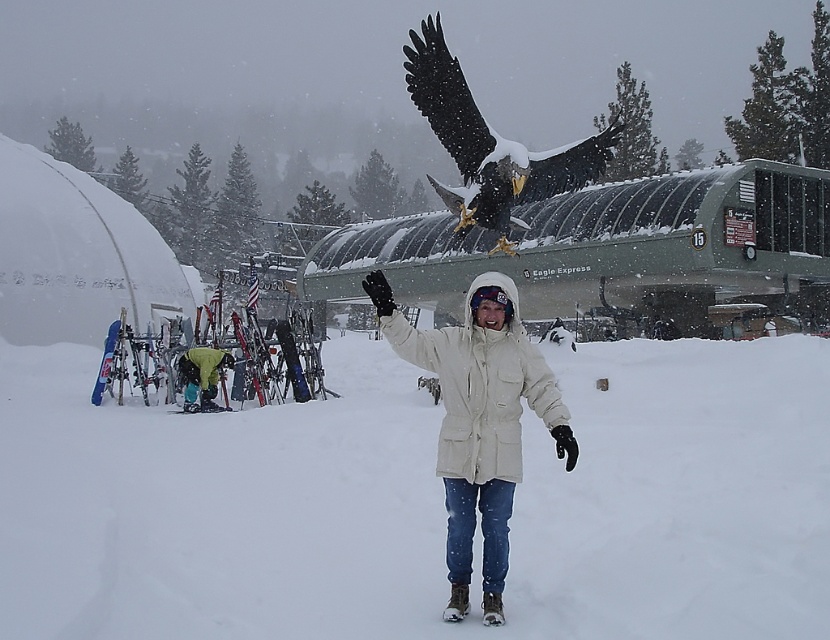
Question: Based on their relative distances, which object is farther from the transparent plastic goggles at center?

Choices:
 (A) snow-covered eagle at upper center
 (B) white matte glove at center
 (C) beige cotton jacket at center
 (D) green snowsuit at lower left

Answer: (A)

Question: Which of these objects is positioned closest to the transparent plastic goggles at center?

Choices:
 (A) white matte glove at center
 (B) snow-covered eagle at upper center

Answer: (A)

Question: Is beige cotton jacket at center above snow-covered eagle at upper center?

Choices:
 (A) no
 (B) yes

Answer: (A)

Question: Is snow-covered eagle at upper center to the right of white matte glove at center from the viewer's perspective?

Choices:
 (A) no
 (B) yes

Answer: (B)

Question: Among these objects, which one is nearest to the camera?

Choices:
 (A) white snow at center
 (B) snow-covered eagle at upper center
 (C) transparent plastic goggles at center

Answer: (A)

Question: Is beige cotton jacket at center wider than transparent plastic goggles at center?

Choices:
 (A) yes
 (B) no

Answer: (A)